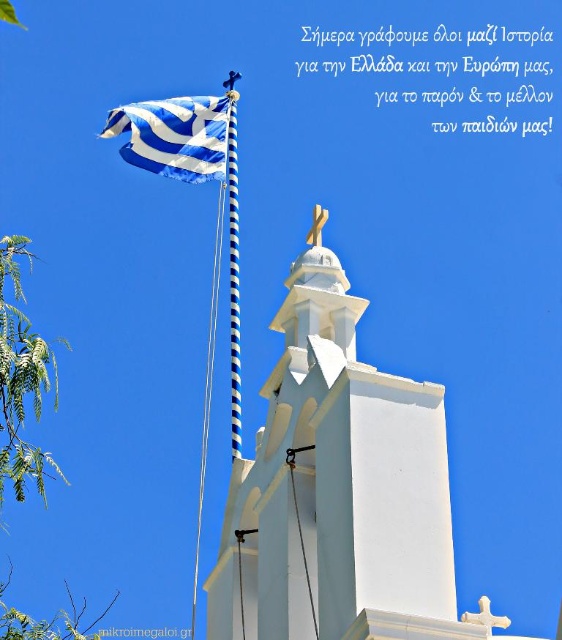
Is point (157, 154) more distant than point (229, 116)?

No, it is not.

Which is behind, point (135, 120) or point (233, 118)?

The point (135, 120) is behind.

At what (x,y) coordinates should I click in order to perform the action: click on blue and white striped flag at upper left. Please return your answer as a coordinate pair (x, y). Looking at the image, I should click on (174, 134).

Does point (446, 554) come in front of point (241, 426)?

That is True.

Is white smooth tower at center to the left of blue striped pole at upper center from the viewer's perspective?

In fact, white smooth tower at center is to the right of blue striped pole at upper center.

Where is `white smooth tower at center`? Image resolution: width=562 pixels, height=640 pixels. white smooth tower at center is located at coordinates (334, 483).

Is white smooth tower at center to the right of blue and white striped flag at upper left from the viewer's perspective?

Indeed, white smooth tower at center is positioned on the right side of blue and white striped flag at upper left.

Which is below, white smooth tower at center or blue and white striped flag at upper left?

Positioned lower is white smooth tower at center.

Image resolution: width=562 pixels, height=640 pixels. Describe the element at coordinates (334, 483) in the screenshot. I see `white smooth tower at center` at that location.

Locate an element on the screen. This screenshot has height=640, width=562. white smooth tower at center is located at coordinates (334, 483).